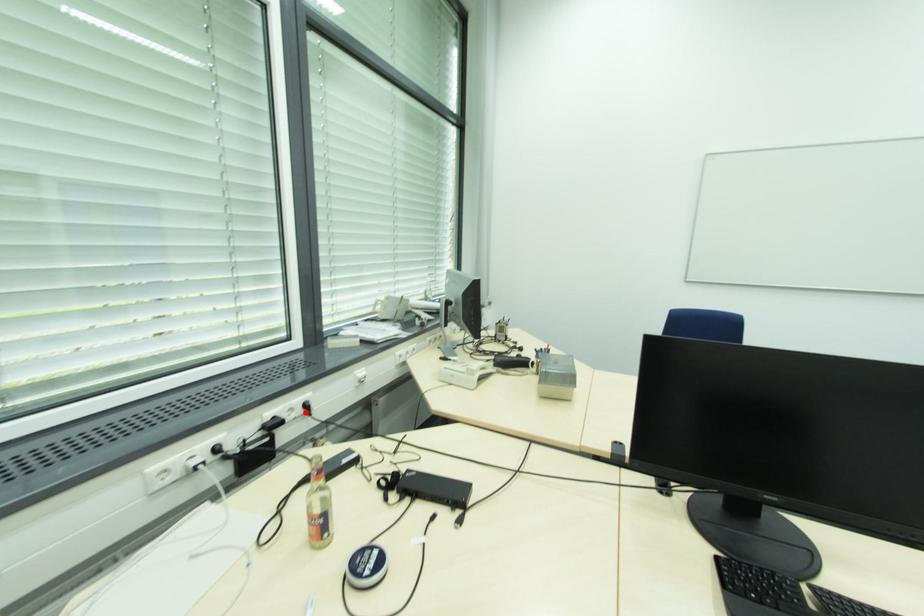
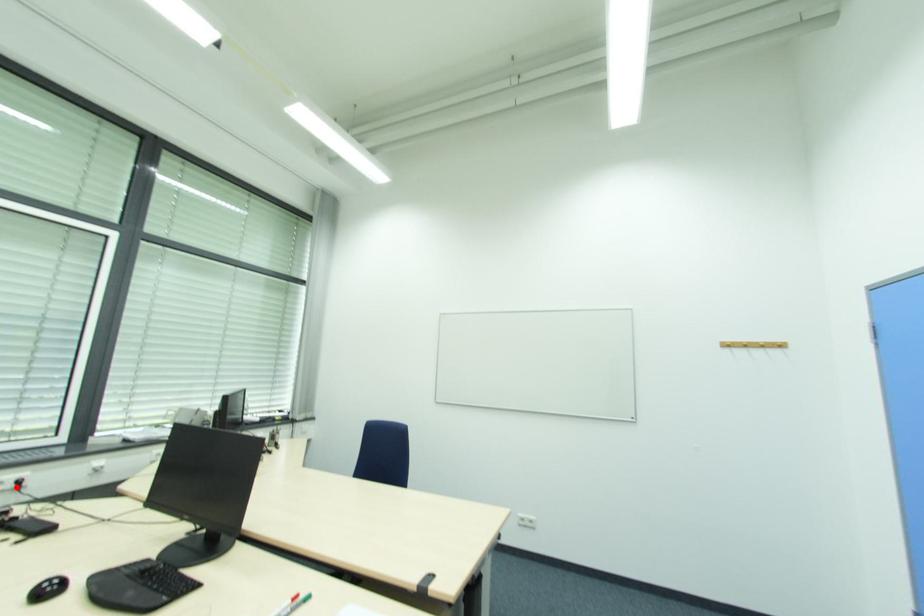
In the scene shown: I am providing you with two images of the same scene from different viewpoints. A red point is marked on the first image and another point is marked on the second image. Is the red point in image1 aligned with the point shown in image2?

Yes